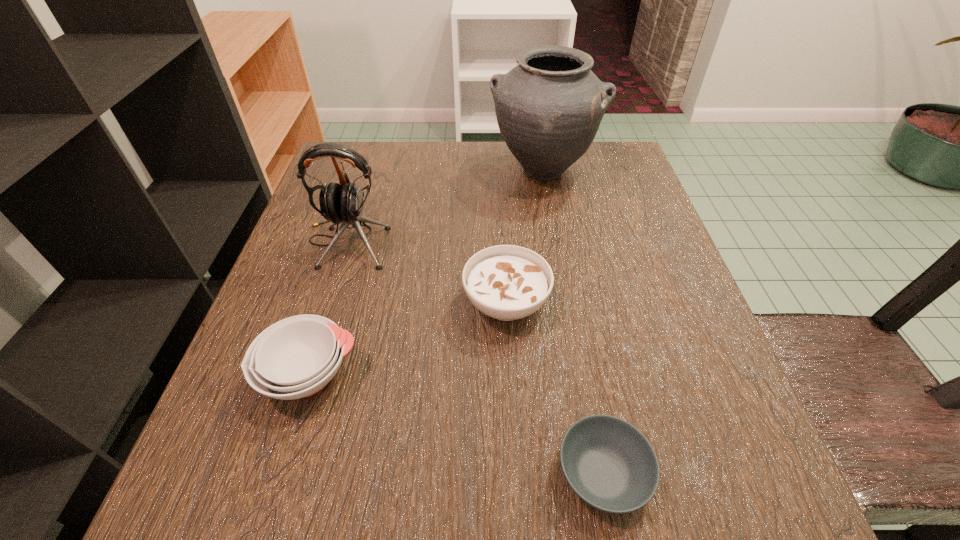
Locate which object is the third closest to the shortest soup bowl. Please provide its 2D coordinates. Your answer should be formatted as a tuple, i.e. [(x, y)], where the tuple contains the x and y coordinates of a point satisfying the conditions above.

[(343, 203)]

Image resolution: width=960 pixels, height=540 pixels. What are the coordinates of `object that is the second closest to the farthest object` in the screenshot? It's located at (506, 282).

Image resolution: width=960 pixels, height=540 pixels. Find the location of `soup bowl that is the closest to the earphone`. soup bowl that is the closest to the earphone is located at coordinates (506, 282).

Where is `the third closest soup bowl to the urn`? the third closest soup bowl to the urn is located at coordinates (609, 464).

At what (x,y) coordinates should I click in order to perform the action: click on vacant space that satisfies the following two spatial constraints: 1. on the back side of the second tallest object; 2. on the left side of the urn. Please return your answer as a coordinate pair (x, y). Looking at the image, I should click on (370, 170).

This screenshot has width=960, height=540. I want to click on blank area in the image that satisfies the following two spatial constraints: 1. on the front side of the farthest object; 2. on the right side of the nearest object, so click(x=597, y=474).

You are a GUI agent. You are given a task and a screenshot of the screen. Output one action in this format:
    pyautogui.click(x=<x>, y=<y>)
    Task: Click on the vacant region that satisfies the following two spatial constraints: 1. on the front side of the farthest object; 2. on the left side of the shortest soup bowl
    This screenshot has width=960, height=540.
    Given the screenshot: What is the action you would take?
    pyautogui.click(x=597, y=474)

Locate an element on the screen. vacant point that satisfies the following two spatial constraints: 1. on the front side of the urn; 2. on the right side of the shortest soup bowl is located at coordinates (597, 474).